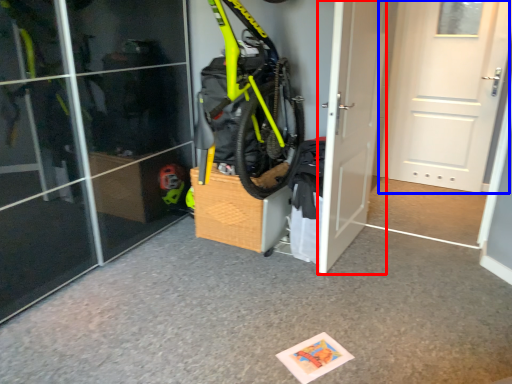
Question: Which object appears farthest to the camera in this image, door (highlighted by a red box) or door (highlighted by a blue box)?

Choices:
 (A) door
 (B) door

Answer: (B)